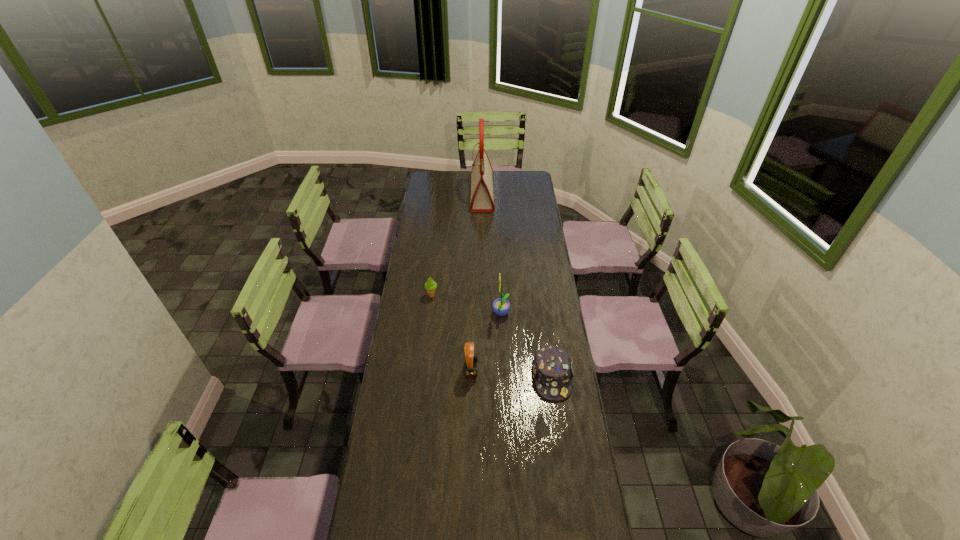
The height and width of the screenshot is (540, 960). In the image, there is a desktop. Identify the location of vacant space at the left edge. (417, 277).

The height and width of the screenshot is (540, 960). In order to click on vacant space at the right edge in this screenshot , I will do 580,440.

The width and height of the screenshot is (960, 540). Identify the location of vacant position at the far left corner of the desktop. (444, 189).

Identify the location of free space between the headset and the tallest object. (477, 282).

Locate an element on the screen. free space that is in between the handbag and the headset is located at coordinates 477,282.

You are a GUI agent. You are given a task and a screenshot of the screen. Output one action in this format:
    pyautogui.click(x=<x>, y=<y>)
    Task: Click on the vacant space that's between the sunflower and the headwear
    The height and width of the screenshot is (540, 960).
    Given the screenshot: What is the action you would take?
    (x=526, y=346)

At what (x,y) coordinates should I click in order to perform the action: click on free spot between the handbag and the sunflower. Please return your answer as a coordinate pair (x, y). The height and width of the screenshot is (540, 960). Looking at the image, I should click on (492, 254).

At what (x,y) coordinates should I click in order to perform the action: click on free area in between the tallest object and the headset. Please return your answer as a coordinate pair (x, y). This screenshot has height=540, width=960. Looking at the image, I should click on (477, 282).

Find the location of a particular element. The width and height of the screenshot is (960, 540). free spot between the icecream and the shortest object is located at coordinates (492, 336).

Locate an element on the screen. blank region between the headwear and the third farthest object is located at coordinates (526, 346).